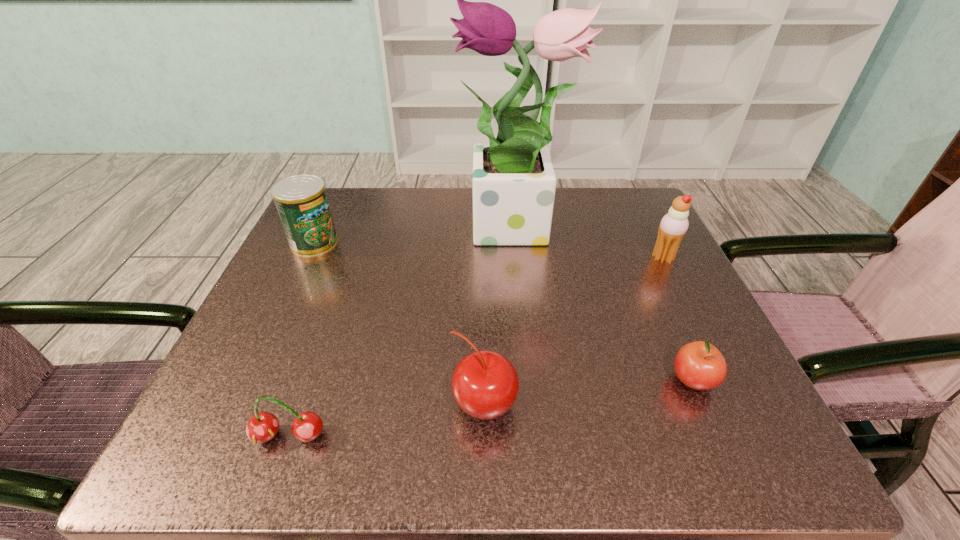
Locate an element on the screen. free space located at the front with a straw on the icecream is located at coordinates (463, 258).

Locate an element on the screen. The width and height of the screenshot is (960, 540). vacant space located at the front with a straw on the icecream is located at coordinates (584, 258).

Image resolution: width=960 pixels, height=540 pixels. In order to click on vacant space located at the front with a straw on the icecream in this screenshot , I will do `click(531, 258)`.

Locate an element on the screen. The height and width of the screenshot is (540, 960). vacant region located 0.250m on the front of the can is located at coordinates (263, 350).

Find the location of a particular element. vacant position located 0.140m on the right of the right cherry is located at coordinates (612, 405).

This screenshot has width=960, height=540. What are the coordinates of `free location located on the left of the apple` in the screenshot? It's located at [x=484, y=381].

Identify the location of flower arrangement at the far edge. The width and height of the screenshot is (960, 540). (514, 182).

Where is `can positioned at the far edge`? can positioned at the far edge is located at coordinates (x=301, y=200).

Find the location of a particular element. The height and width of the screenshot is (540, 960). can positioned at the left edge is located at coordinates (301, 200).

Where is `cherry that is at the left edge`? The width and height of the screenshot is (960, 540). cherry that is at the left edge is located at coordinates (262, 427).